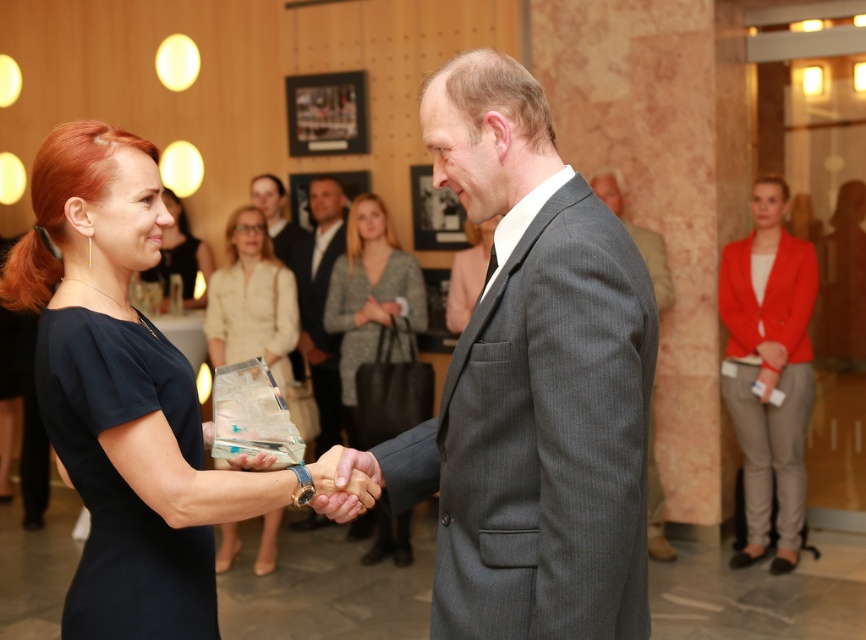
Which is behind, point (359, 360) or point (276, 288)?

Positioned behind is point (359, 360).

Does point (346, 250) come farther from viewer compared to point (241, 337)?

Yes, point (346, 250) is farther from viewer.

Where is `matte gray sweater at center`? matte gray sweater at center is located at coordinates (373, 314).

Between point (257, 259) and point (479, 282), which one is positioned in front?

Point (257, 259) is in front.

Is point (278, 310) positioned before point (483, 243)?

Yes, it is.

Between point (234, 525) and point (447, 328), which one is positioned in front?

Point (234, 525) is in front.

Where is `transparent glass award at center`? This screenshot has height=640, width=866. transparent glass award at center is located at coordinates (251, 300).

Who is higher up, gray suit at center or matte gray suit at center?

Positioned higher is matte gray suit at center.

Can you confirm if gray suit at center is smaller than matte gray suit at center?

Actually, gray suit at center might be larger than matte gray suit at center.

Is point (302, 326) in front of point (270, 228)?

Yes.

You are a GUI agent. You are given a task and a screenshot of the screen. Output one action in this format:
    pyautogui.click(x=<x>, y=<y>)
    Task: Click on the gray suit at center
    
    Given the screenshot: What is the action you would take?
    pyautogui.click(x=320, y=304)